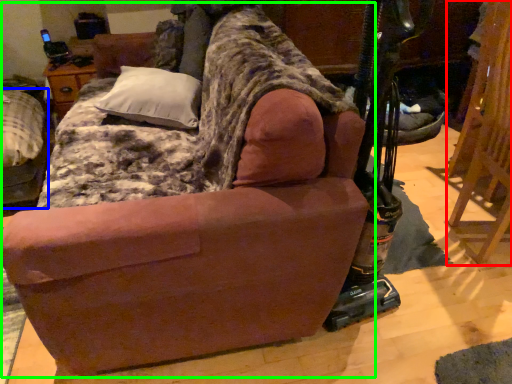
Question: Which object is the farthest from folding chair (highlighted by a red box)? Choose among these: furniture (highlighted by a blue box) or studio couch (highlighted by a green box).

Choices:
 (A) furniture
 (B) studio couch

Answer: (A)